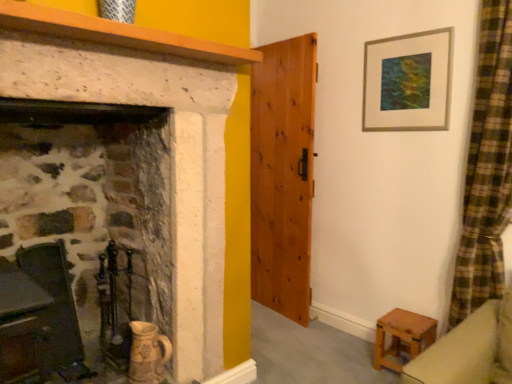
Question: Does wooden stool at lower right have a lesser width compared to metallic silver picture frame at upper right?

Choices:
 (A) yes
 (B) no

Answer: (B)

Question: Is wooden stool at lower right to the left of metallic silver picture frame at upper right from the viewer's perspective?

Choices:
 (A) no
 (B) yes

Answer: (B)

Question: Does wooden stool at lower right have a larger size compared to metallic silver picture frame at upper right?

Choices:
 (A) yes
 (B) no

Answer: (A)

Question: From a real-world perspective, is wooden stool at lower right physically below metallic silver picture frame at upper right?

Choices:
 (A) yes
 (B) no

Answer: (A)

Question: Does wooden stool at lower right have a lesser height compared to metallic silver picture frame at upper right?

Choices:
 (A) yes
 (B) no

Answer: (A)

Question: From the image's perspective, is wooden stool at lower right over metallic silver picture frame at upper right?

Choices:
 (A) yes
 (B) no

Answer: (B)

Question: From the image's perspective, is wooden chair at left on metallic silver picture frame at upper right?

Choices:
 (A) no
 (B) yes

Answer: (A)

Question: Could metallic silver picture frame at upper right be considered to be inside wooden chair at left?

Choices:
 (A) no
 (B) yes

Answer: (A)

Question: Is wooden chair at left facing towards metallic silver picture frame at upper right?

Choices:
 (A) yes
 (B) no

Answer: (B)

Question: Is wooden chair at left bigger than metallic silver picture frame at upper right?

Choices:
 (A) no
 (B) yes

Answer: (B)

Question: Considering the relative positions of wooden chair at left and metallic silver picture frame at upper right in the image provided, is wooden chair at left to the left of metallic silver picture frame at upper right from the viewer's perspective?

Choices:
 (A) yes
 (B) no

Answer: (A)

Question: Is wooden chair at left taller than metallic silver picture frame at upper right?

Choices:
 (A) no
 (B) yes

Answer: (B)

Question: Considering the relative positions of metallic silver picture frame at upper right and smooth wooden mantle at upper left in the image provided, is metallic silver picture frame at upper right in front of smooth wooden mantle at upper left?

Choices:
 (A) no
 (B) yes

Answer: (A)